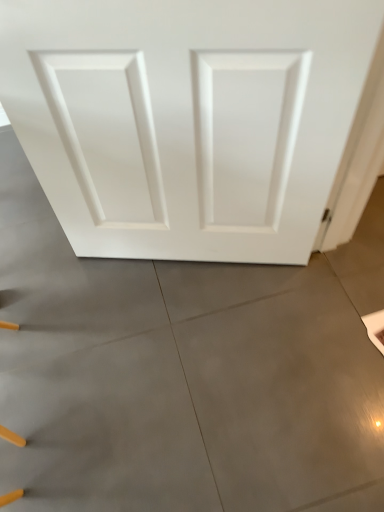
Find the location of a particular element. This screenshot has width=384, height=512. white glossy door at center is located at coordinates (189, 120).

The image size is (384, 512). What do you see at coordinates (189, 120) in the screenshot? I see `white glossy door at center` at bounding box center [189, 120].

What is the approximate height of white glossy door at center?

white glossy door at center is 35.77 inches tall.

I want to click on white glossy door at center, so click(189, 120).